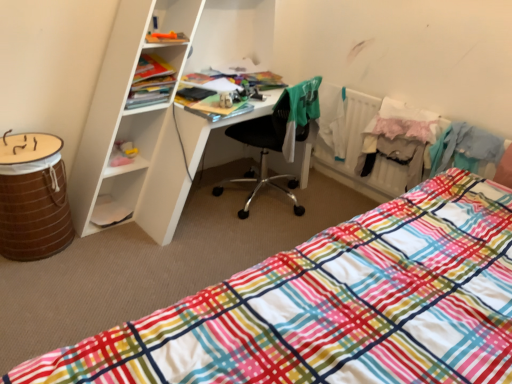
Where is `vacant space situated on the left part of black plastic chair at center`? The image size is (512, 384). vacant space situated on the left part of black plastic chair at center is located at coordinates click(205, 198).